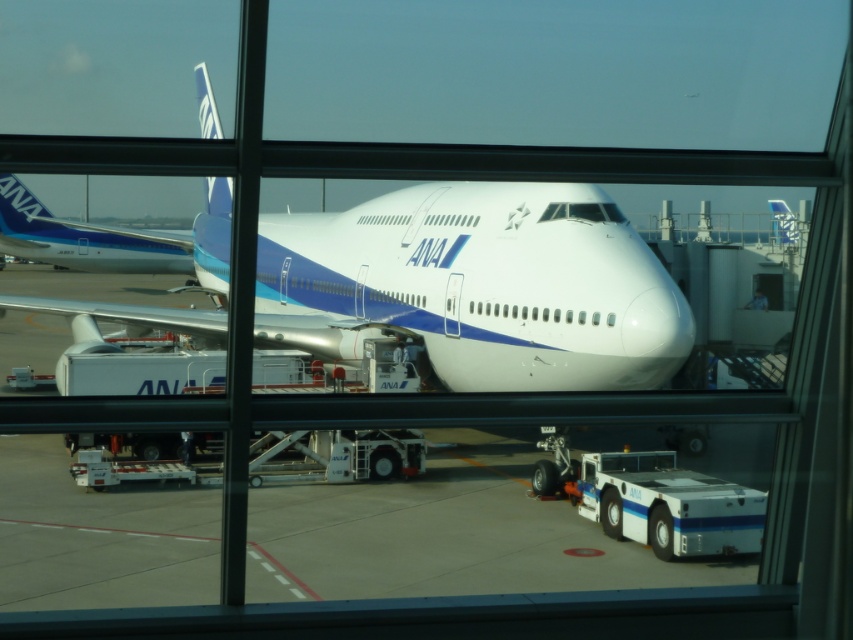
Can you confirm if white glossy airplane at center is smaller than matte blue airplane at left?

No, white glossy airplane at center is not smaller than matte blue airplane at left.

You are a GUI agent. You are given a task and a screenshot of the screen. Output one action in this format:
    pyautogui.click(x=<x>, y=<y>)
    Task: Click on the white glossy airplane at center
    
    Given the screenshot: What is the action you would take?
    pyautogui.click(x=479, y=285)

This screenshot has height=640, width=853. Identify the location of white glossy airplane at center. (479, 285).